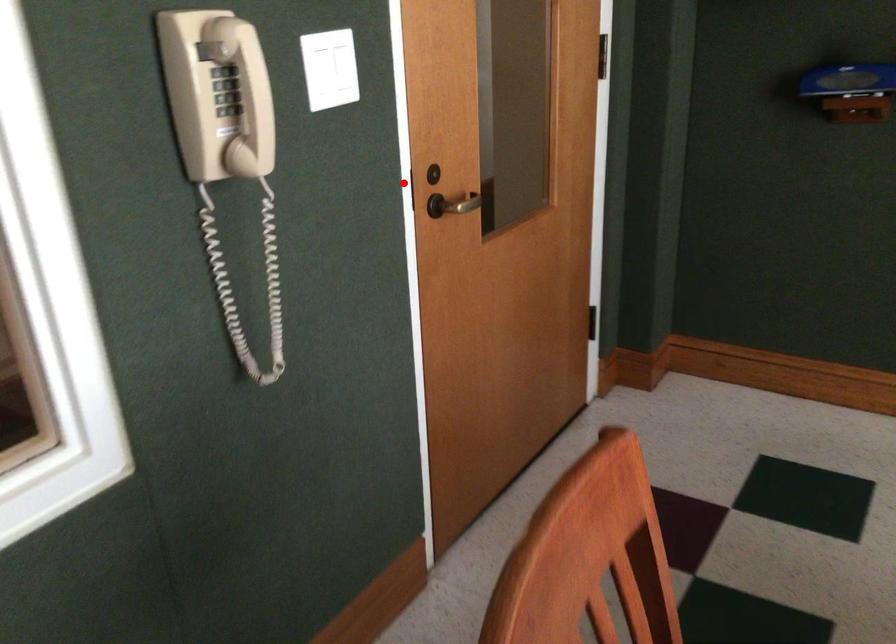
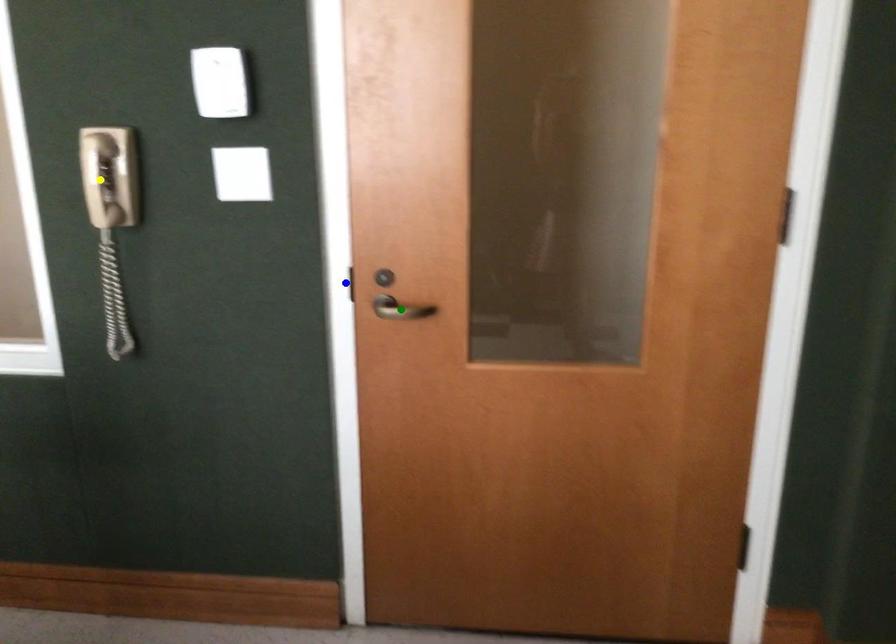
Question: I am providing you with two images of the same scene from different viewpoints. A red point is marked on the first image. You are given multiple points on the second image. Which point in image 2 is actually the same real-world point as the red point in image 1?

Choices:
 (A) blue point
 (B) yellow point
 (C) green point

Answer: (A)